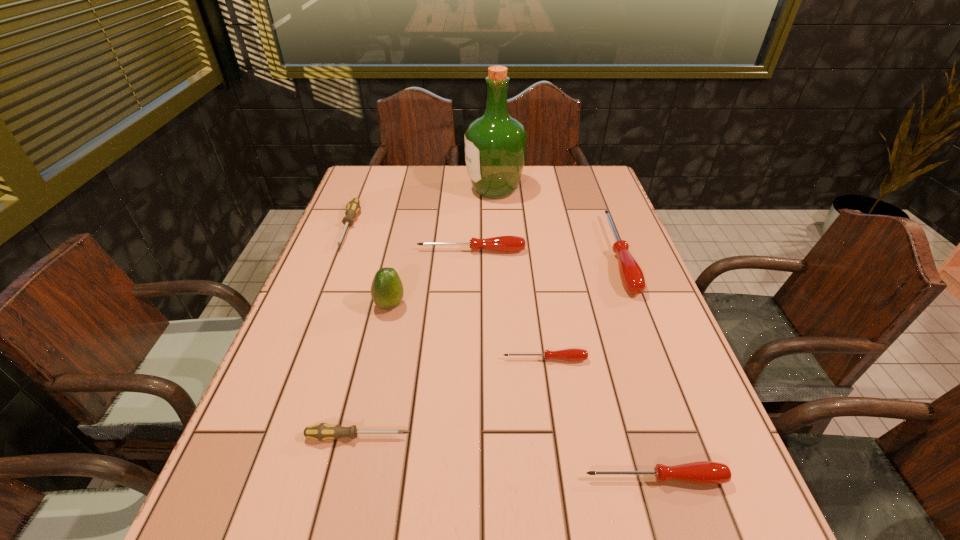
The image size is (960, 540). What are the coordinates of `the nearest red screwdriver` in the screenshot? It's located at (702, 472).

Identify the location of the right gray screwdriver. The height and width of the screenshot is (540, 960). (322, 431).

The width and height of the screenshot is (960, 540). In order to click on the smaller gray screwdriver in this screenshot , I will do `click(322, 431)`.

The image size is (960, 540). In order to click on the shortest object in this screenshot , I will do `click(574, 354)`.

Identify the location of the third farthest red screwdriver. (574, 354).

Locate an element on the screen. This screenshot has width=960, height=540. blank area located 0.290m on the front-facing side of the farthest object is located at coordinates (379, 190).

Find the location of a particular element. The image size is (960, 540). free space located 0.070m on the front-facing side of the farthest object is located at coordinates (444, 190).

Find the location of `vacant space located on the front-facing side of the farthest object`. vacant space located on the front-facing side of the farthest object is located at coordinates (370, 190).

Find the location of a particular element. This screenshot has height=540, width=960. vacant area located on the left of the green avocado is located at coordinates (303, 305).

This screenshot has height=540, width=960. I want to click on free location located on the left of the third tallest object, so click(571, 254).